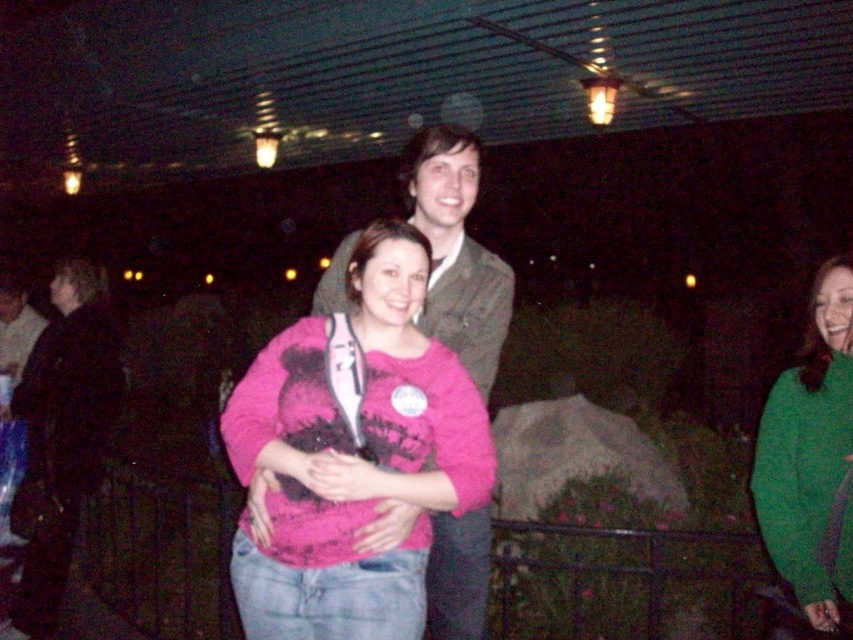
Question: Is pink fleece sweater at center to the left of green fuzzy sweater at right from the viewer's perspective?

Choices:
 (A) yes
 (B) no

Answer: (A)

Question: Where is pink fleece sweater at center located in relation to green fuzzy sweater at right in the image?

Choices:
 (A) left
 (B) right

Answer: (A)

Question: Which of the following is the closest to the observer?

Choices:
 (A) (769, 531)
 (B) (239, 442)

Answer: (B)

Question: Among these points, which one is nearest to the camera?

Choices:
 (A) (279, 365)
 (B) (799, 428)

Answer: (A)

Question: Can you confirm if pink fleece sweater at center is positioned to the right of green fuzzy sweater at right?

Choices:
 (A) yes
 (B) no

Answer: (B)